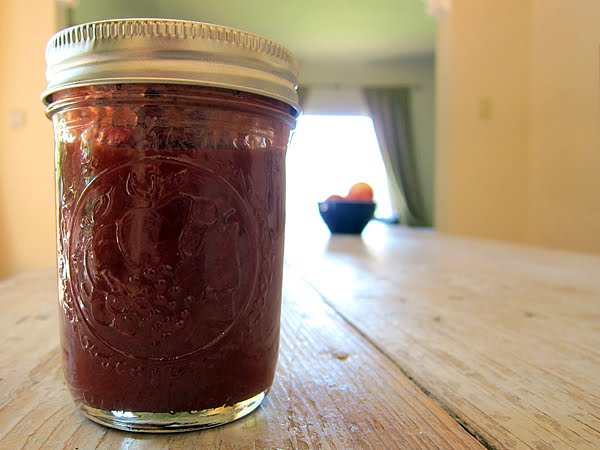
Where is `window`? This screenshot has height=450, width=600. window is located at coordinates (351, 161).